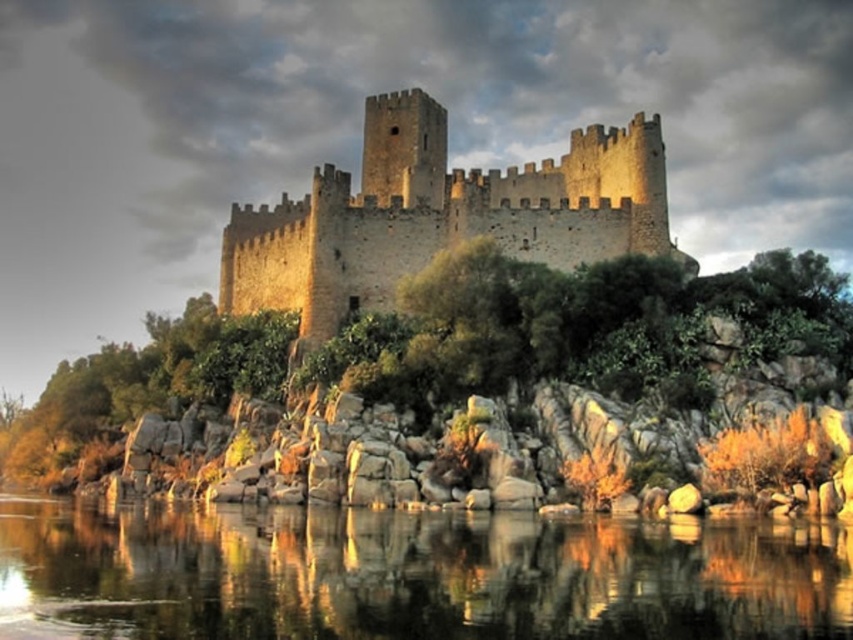
What do you see at coordinates (409, 576) in the screenshot? The width and height of the screenshot is (853, 640). I see `transparent water at lower center` at bounding box center [409, 576].

Who is more forward, (701, 573) or (450, 182)?

Point (701, 573) is in front.

Between point (241, 604) and point (316, 240), which one is positioned behind?

Positioned behind is point (316, 240).

Where is `transparent water at lower center`? The image size is (853, 640). transparent water at lower center is located at coordinates (x=409, y=576).